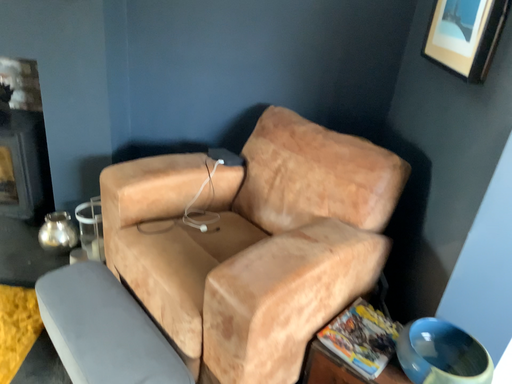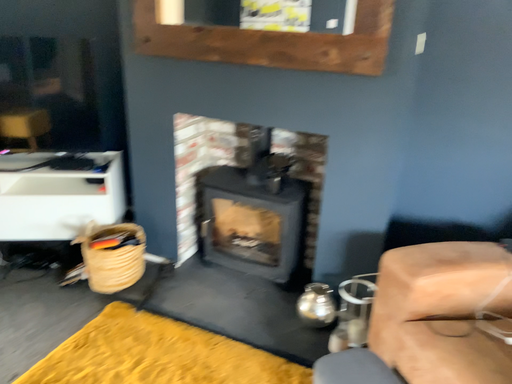
Question: How did the camera likely rotate when shooting the video?

Choices:
 (A) rotated left
 (B) rotated right

Answer: (A)